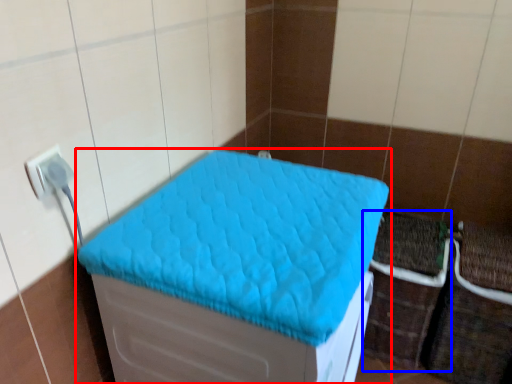
Question: Which of the following is the farthest to the observer, furniture (highlighted by a red box) or crate (highlighted by a blue box)?

Choices:
 (A) furniture
 (B) crate

Answer: (B)